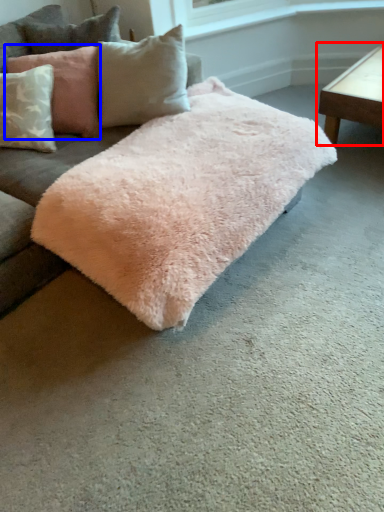
Question: Which object appears closest to the camera in this image, table (highlighted by a red box) or pillow (highlighted by a blue box)?

Choices:
 (A) table
 (B) pillow

Answer: (B)